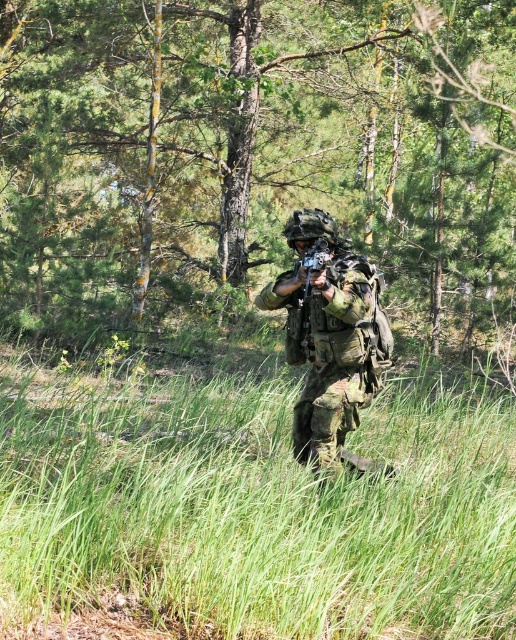
Question: Does camouflage fabric uniform at center have a larger size compared to matte black rifle at center?

Choices:
 (A) no
 (B) yes

Answer: (B)

Question: Is green leafy tree at center positioned before camouflage fabric uniform at center?

Choices:
 (A) no
 (B) yes

Answer: (A)

Question: Is green leafy tree at center above green grassy at center?

Choices:
 (A) no
 (B) yes

Answer: (B)

Question: Which is farther from the matte black rifle at center?

Choices:
 (A) green leafy tree at center
 (B) green grassy at center

Answer: (A)

Question: Among these objects, which one is farthest from the camera?

Choices:
 (A) matte black rifle at center
 (B) camouflage fabric uniform at center
 (C) green leafy tree at center

Answer: (C)

Question: Which object appears closest to the camera in this image?

Choices:
 (A) green leafy tree at center
 (B) camouflage fabric uniform at center

Answer: (B)